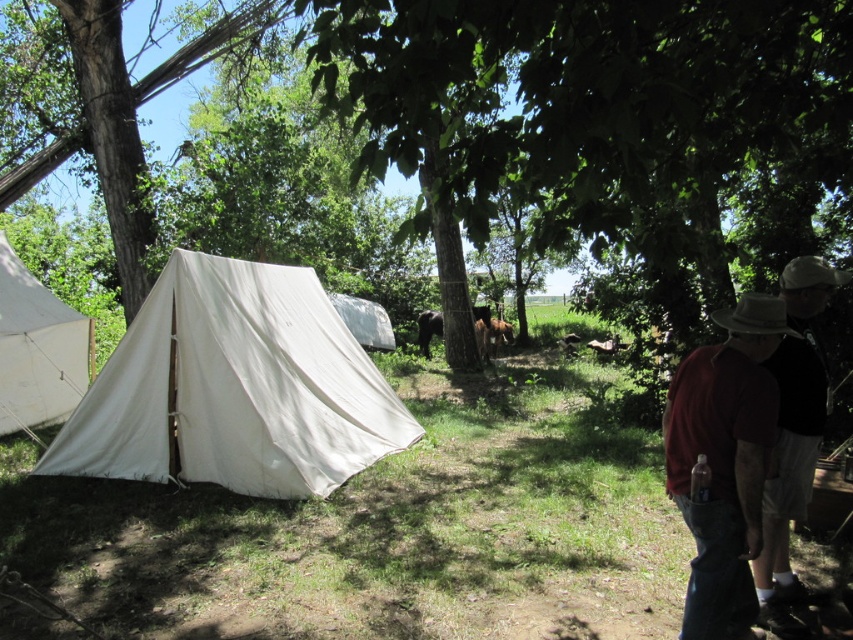
Question: Is brown canvas hat at right further to the viewer compared to white canvas tent at center?

Choices:
 (A) no
 (B) yes

Answer: (A)

Question: Can you confirm if white canvas tent at left is positioned above brown canvas hat at right?

Choices:
 (A) no
 (B) yes

Answer: (A)

Question: Which point is closer to the camera?

Choices:
 (A) (190, 259)
 (B) (422, 352)
 (C) (497, 340)
 (D) (833, 275)

Answer: (D)

Question: Does brown furry dog at center have a lesser width compared to brown furry horse at center?

Choices:
 (A) no
 (B) yes

Answer: (A)

Question: Which object is positioned farthest from the white canvas tent at center?

Choices:
 (A) brown canvas hat at right
 (B) white canvas tent at left

Answer: (A)

Question: Which of the following is the closest to the observer?

Choices:
 (A) (799, 422)
 (B) (505, 323)

Answer: (A)